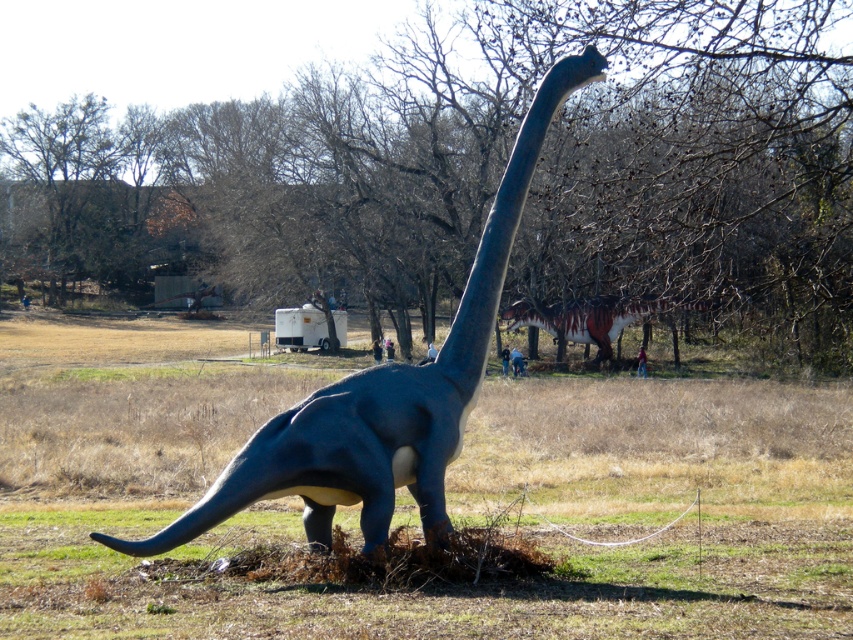
Question: Can you confirm if green grass at lower center is positioned above shiny metallic dinosaur at center?

Choices:
 (A) yes
 (B) no

Answer: (B)

Question: Which point is closer to the camera taking this photo?

Choices:
 (A) (349, 484)
 (B) (552, 316)
 (C) (132, 525)

Answer: (A)

Question: From the image, what is the correct spatial relationship of shiny blue dinosaur at center in relation to shiny metallic dinosaur at center?

Choices:
 (A) left
 (B) right

Answer: (A)

Question: Is shiny blue dinosaur at center to the left of shiny metallic dinosaur at center from the viewer's perspective?

Choices:
 (A) no
 (B) yes

Answer: (B)

Question: Which point is closer to the camera?

Choices:
 (A) (759, 608)
 (B) (601, 356)

Answer: (A)

Question: Among these points, which one is farthest from the camera?

Choices:
 (A) (369, 424)
 (B) (664, 300)
 (C) (115, 531)

Answer: (B)